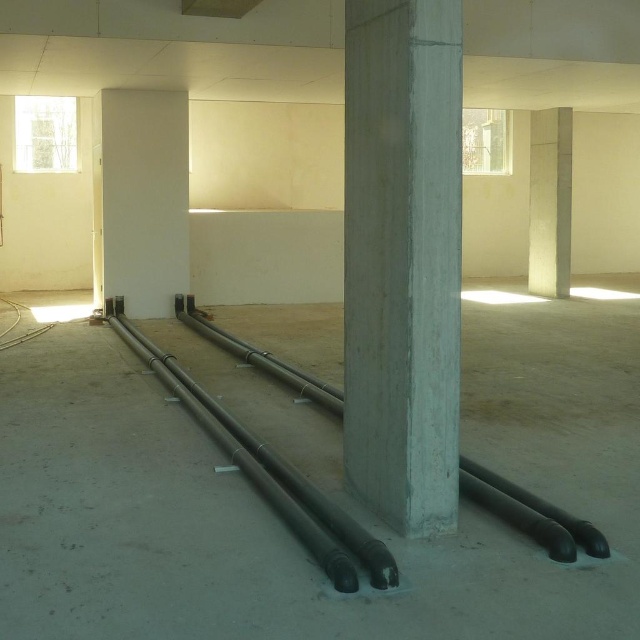
Can you confirm if black rubber pipe at center is positioned above smooth concrete pillar at center?

Incorrect, black rubber pipe at center is not positioned above smooth concrete pillar at center.

Is black rubber pipe at center positioned before smooth concrete pillar at center?

Yes, it is in front of smooth concrete pillar at center.

Between point (300, 516) and point (532, 227), which one is positioned behind?

Point (532, 227)

Identify the location of black rubber pipe at center. (285, 476).

Is black matte pipes at center in front of black rubber pipe at center?

No, black matte pipes at center is behind black rubber pipe at center.

Is black matte pipes at center taller than black rubber pipe at center?

No.

At what (x,y) coordinates should I click in order to perform the action: click on black matte pipes at center. Please return your answer as a coordinate pair (x, y). This screenshot has width=640, height=640. Looking at the image, I should click on (531, 513).

Identify the location of black matte pipes at center. (531, 513).

Does concrete at center appear under black rubber pipe at center?

Actually, concrete at center is above black rubber pipe at center.

Is point (454, 308) farther from viewer compared to point (294, 481)?

That is False.

Who is more distant from viewer, (358, 154) or (292, 484)?

Positioned behind is point (292, 484).

Where is `concrete at center`? The width and height of the screenshot is (640, 640). concrete at center is located at coordinates (403, 259).